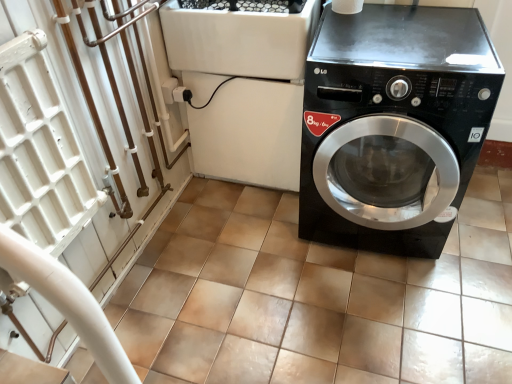
The height and width of the screenshot is (384, 512). I want to click on free space in front of black plastic washing machine at center, so click(x=240, y=233).